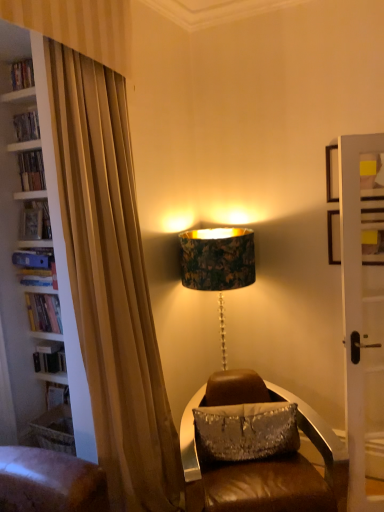
Question: Is hardcover book at left, which is the 4th book in top-to-bottom order, in front of or behind brown leather chair at center in the image?

Choices:
 (A) front
 (B) behind

Answer: (B)

Question: From the image's perspective, is hardcover book at left, which is the 4th book in top-to-bottom order, located above or below brown leather chair at center?

Choices:
 (A) below
 (B) above

Answer: (B)

Question: Which of these objects is positioned farthest from the hardcover book at left, acting as the third book starting from the bottom?

Choices:
 (A) hardcover book at left, positioned as the first book in top-to-bottom order
 (B) blue hardcover book at left, which is the 2th book from bottom to top
 (C) hardcover book at left, the first book ordered from the bottom
 (D) brown leather chair at center
 (E) silver sequined pillow at center

Answer: (D)

Question: Which object is the closest to the hardcover book at left, which appears as the 2th book when viewed from the top?

Choices:
 (A) silver sequined pillow at center
 (B) blue hardcover book at left, the 3th book positioned from the top
 (C) hardcover book at left, positioned as the first book in top-to-bottom order
 (D) brown leather chair at center
 (E) wooden bookshelf at upper left

Answer: (B)